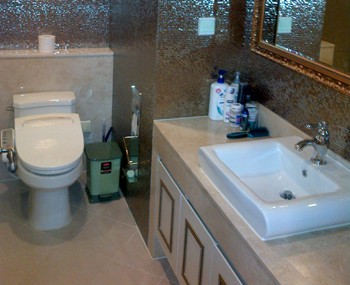
The image size is (350, 285). What are the coordinates of `counter` in the screenshot? It's located at (186, 138).